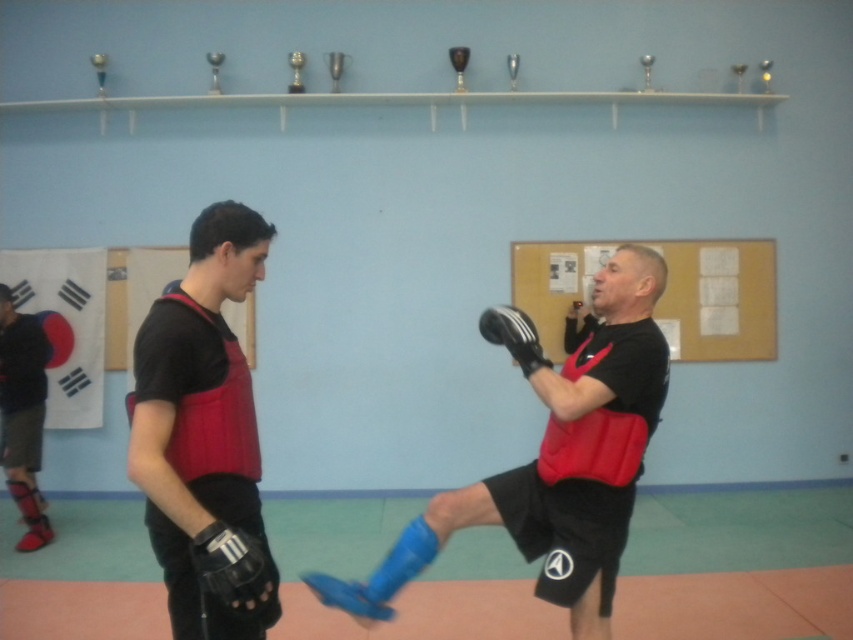
You are a martial arts instructor observing the sparring session. You notice the matte black vest at center and the black leather boxing glove at lower left. Which object is located higher in the image?

The matte black vest at center is positioned over the black leather boxing glove at lower left, so it is higher in the image.

You are a robot trying to navigate between two points in the gymnasium. The first point is point (573, 584) and the second point is point (213, 552). Which point is further away from the entrance of the gymnasium?

Point (573, 584) is behind point (213, 552), so it is further away from the entrance of the gymnasium.

You are a martial artist standing at the point marked as point (241,586) in the image. You want to retrieve a trophy from the shelf on the light blue wall. The trophy is located at the far right end of the shelf. Can you reach it without moving from your current position?

The distance between point (241,586) and the viewer is 1.78 meters. Since the trophy is at the far right end of the shelf on the light blue wall, you would need to stretch or move closer to reach it, but you cannot move from your current position. Therefore, it might be difficult to reach the trophy without moving.